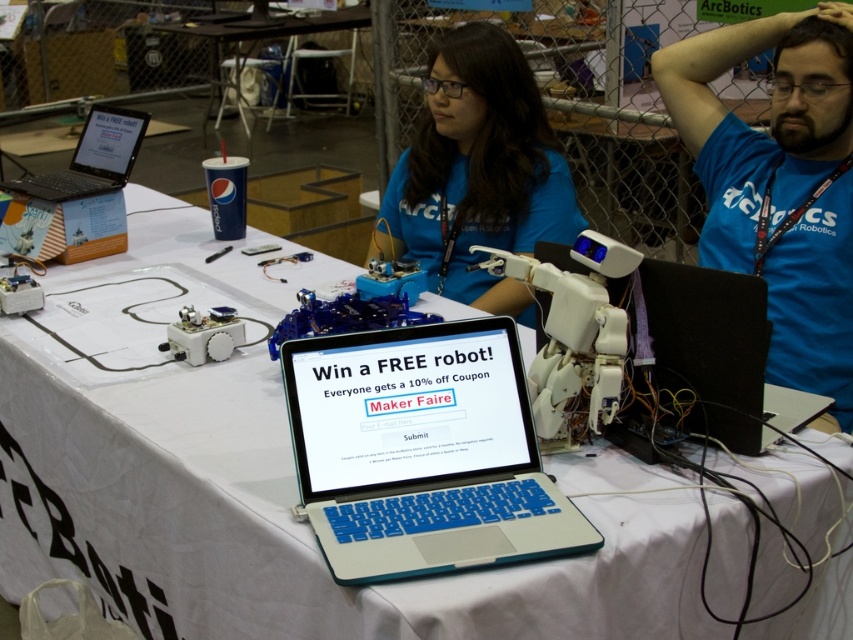
Is point (447, 136) farther from camera compared to point (641, 262)?

Yes, point (447, 136) is behind point (641, 262).

Is blue matte shirt at center smaller than black matte laptop at right?

No, blue matte shirt at center is not smaller than black matte laptop at right.

Describe the element at coordinates (477, 173) in the screenshot. I see `blue matte shirt at center` at that location.

Where is `blue matte shirt at center`? This screenshot has width=853, height=640. blue matte shirt at center is located at coordinates (477, 173).

Which is in front, point (105, 404) or point (706, 33)?

Point (105, 404) is more forward.

Where is `white cloth at center`? This screenshot has width=853, height=640. white cloth at center is located at coordinates (289, 516).

The width and height of the screenshot is (853, 640). What are the coordinates of `white cloth at center` in the screenshot? It's located at (289, 516).

In order to click on white cloth at center in this screenshot , I will do `click(289, 516)`.

Can you confirm if blue plastic laptop at center is wider than blue t-shirt at upper right?

Correct, the width of blue plastic laptop at center exceeds that of blue t-shirt at upper right.

Between blue plastic laptop at center and blue t-shirt at upper right, which one appears on the right side from the viewer's perspective?

blue t-shirt at upper right

The height and width of the screenshot is (640, 853). I want to click on blue plastic laptop at center, so click(422, 452).

Image resolution: width=853 pixels, height=640 pixels. Find the location of `blue plastic laptop at center`. blue plastic laptop at center is located at coordinates (422, 452).